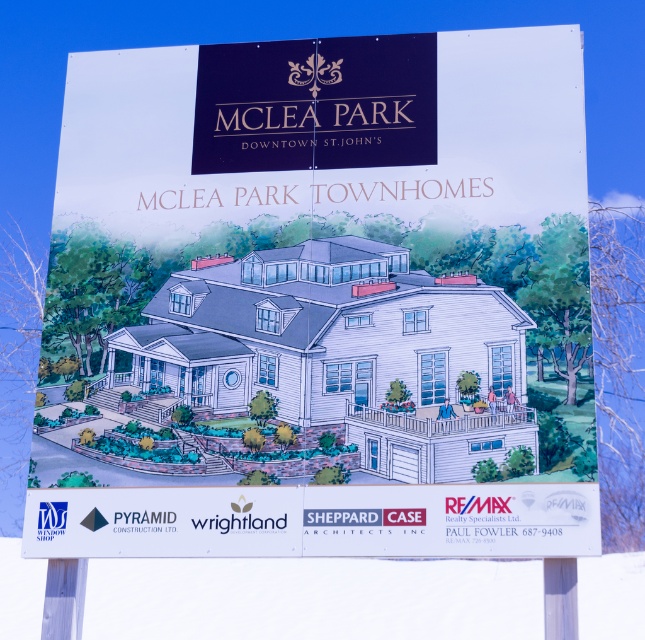
Question: Does wooden post at lower left come behind white plastic pole at lower right?

Choices:
 (A) yes
 (B) no

Answer: (A)

Question: Which point appears closest to the camera in this image?

Choices:
 (A) (41, 628)
 (B) (566, 630)

Answer: (B)

Question: Considering the relative positions of wooden post at lower left and white plastic pole at lower right in the image provided, where is wooden post at lower left located with respect to white plastic pole at lower right?

Choices:
 (A) below
 (B) above

Answer: (A)

Question: Is wooden post at lower left smaller than white plastic pole at lower right?

Choices:
 (A) no
 (B) yes

Answer: (B)

Question: Among these objects, which one is farthest from the camera?

Choices:
 (A) white plastic pole at lower right
 (B) wooden post at lower left

Answer: (B)

Question: Among these objects, which one is farthest from the camera?

Choices:
 (A) white plastic pole at lower right
 (B) wooden post at lower left

Answer: (B)